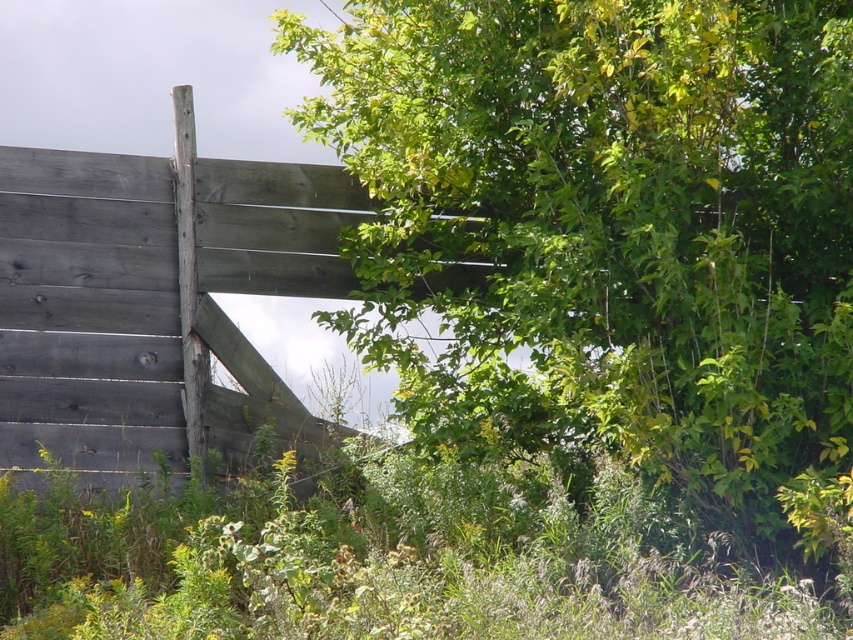
You are standing in a garden and see the green leafy tree at upper center and the weathered gray wood at upper left. Which object is located higher in the scene?

The green leafy tree at upper center is positioned over the weathered gray wood at upper left, so it is higher in the scene.

In the scene shown: Based on the scene description, where is the green leafy tree at upper center located in terms of coordinates?

The green leafy tree at upper center is located at coordinates point (616, 216).

You are standing in a garden and see the green leafy tree at upper center and the weathered gray wood at upper left. Which object is positioned to the right side of the other?

The green leafy tree at upper center is to the right of the weathered gray wood at upper left.